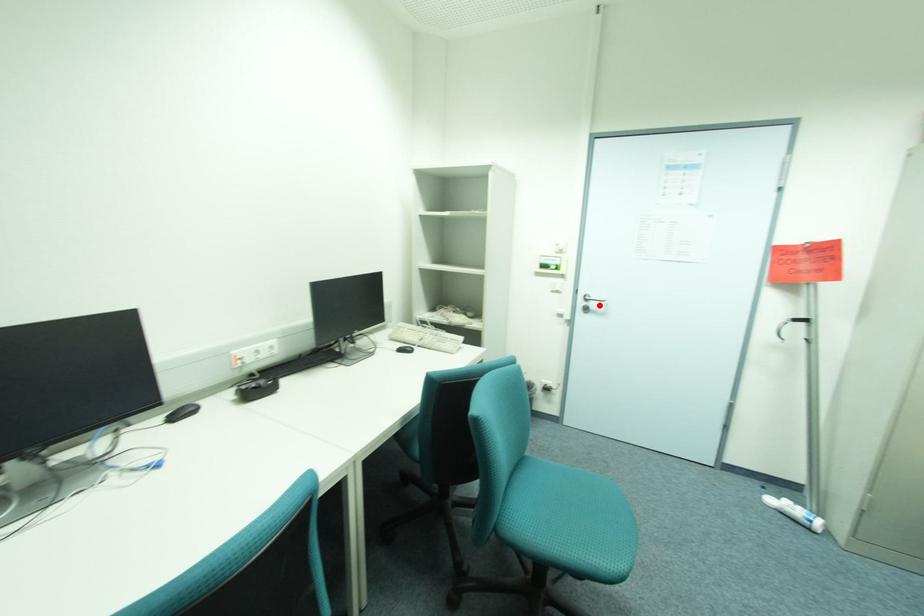
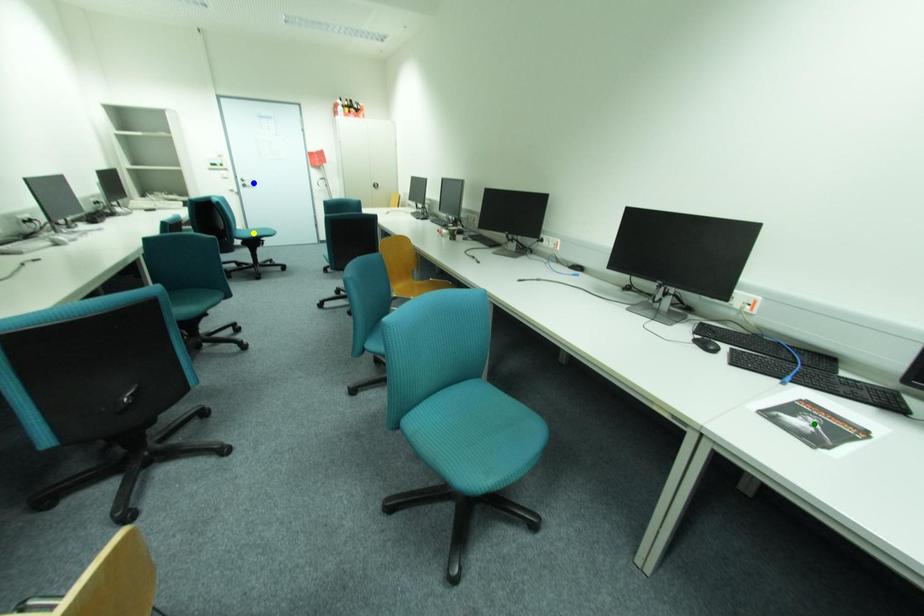
Question: I am providing you with two images of the same scene from different viewpoints. A red point is marked on the first image. You are given multiple points on the second image. Which mark in image 2 goes with the point in image 1?

Choices:
 (A) yellow point
 (B) blue point
 (C) green point

Answer: (B)